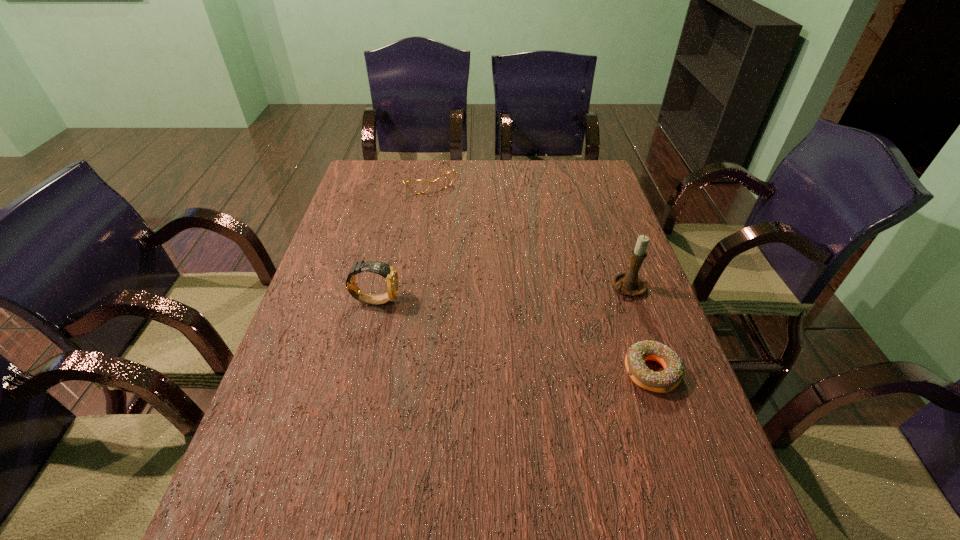
Where is `vacant area situated 0.360m on the front-facing side of the second shortest object`? vacant area situated 0.360m on the front-facing side of the second shortest object is located at coordinates (480, 256).

Identify the location of vacant area situated on the side of the tallest object with the handle. (595, 302).

Where is `blank space located on the side of the tallest object with the handle`? blank space located on the side of the tallest object with the handle is located at coordinates (574, 312).

Where is `free space located on the side of the tallest object with the handle`? The width and height of the screenshot is (960, 540). free space located on the side of the tallest object with the handle is located at coordinates (533, 333).

This screenshot has height=540, width=960. Find the location of `object that is at the far edge`. object that is at the far edge is located at coordinates (416, 186).

Where is `watch located at the left edge`? Image resolution: width=960 pixels, height=540 pixels. watch located at the left edge is located at coordinates (388, 272).

At what (x,y) coordinates should I click in order to perform the action: click on spectacles that is at the left edge. Please return your answer as a coordinate pair (x, y). The image size is (960, 540). Looking at the image, I should click on (416, 186).

I want to click on doughnut that is at the right edge, so click(x=667, y=380).

Locate an element on the screen. This screenshot has height=540, width=960. candle holder that is at the right edge is located at coordinates (628, 282).

At what (x,y) coordinates should I click in order to perform the action: click on object at the far left corner. Please return your answer as a coordinate pair (x, y). This screenshot has height=540, width=960. Looking at the image, I should click on (416, 186).